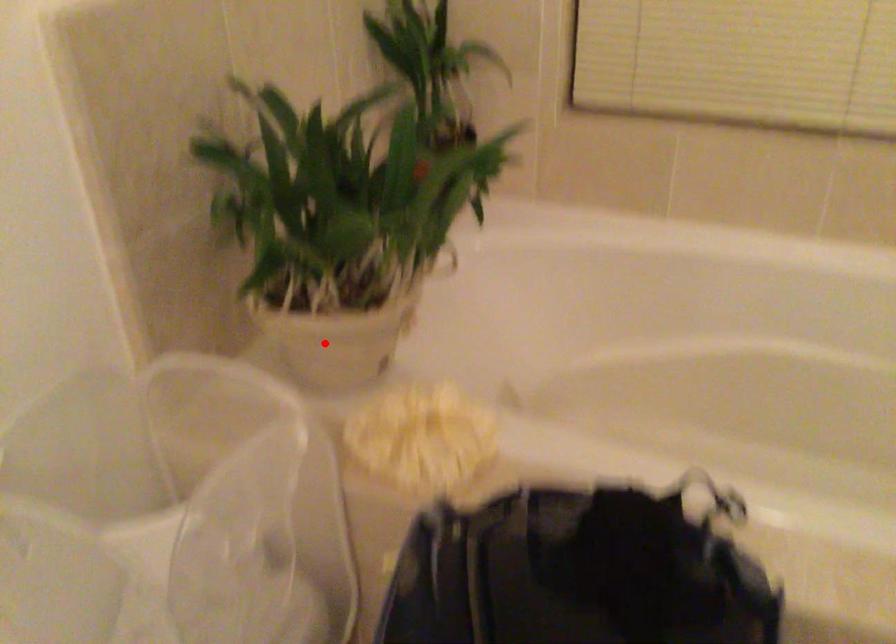
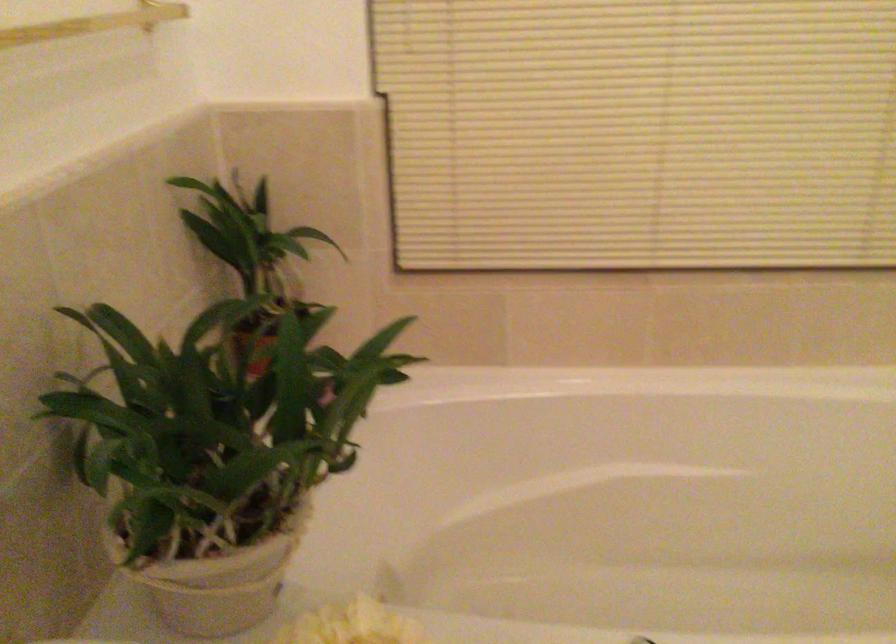
Locate, in the second image, the point that corresponds to the highlighted location in the first image.

(218, 579)